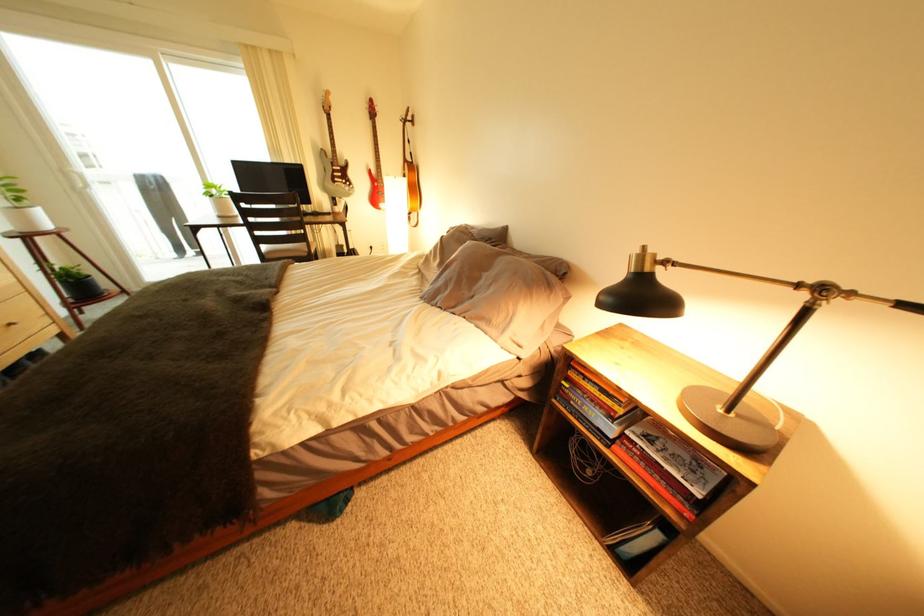
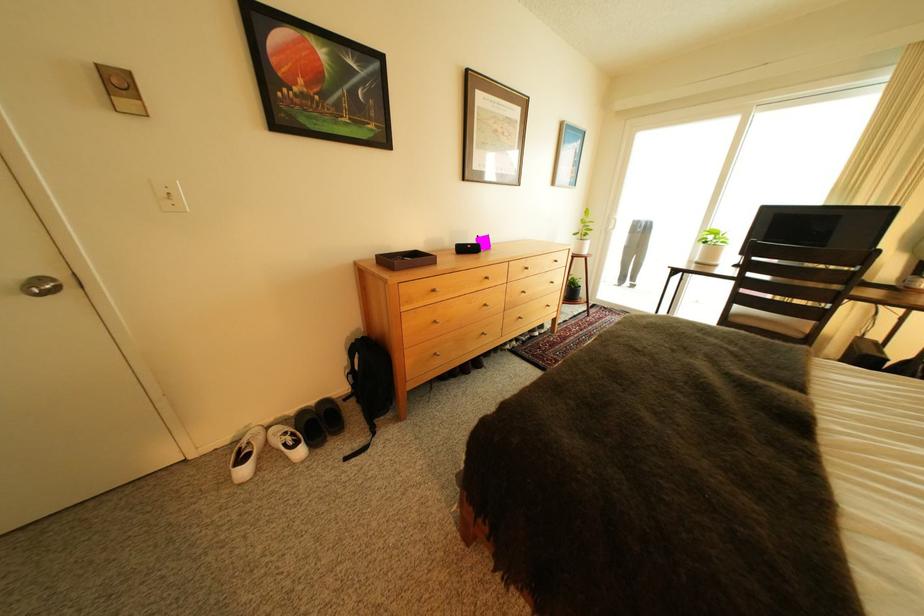
Locate, in the second image, the point that corresponds to [225,198] in the first image.

(718, 244)